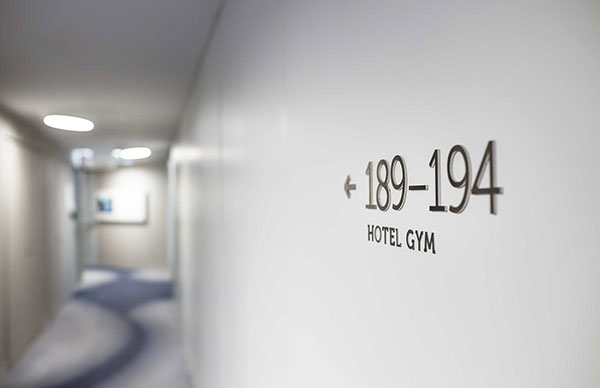
You are a GUI agent. You are given a task and a screenshot of the screen. Output one action in this format:
    pyautogui.click(x=<x>, y=<y>)
    Task: Click on the white door
    
    Given the screenshot: What is the action you would take?
    pyautogui.click(x=78, y=252)